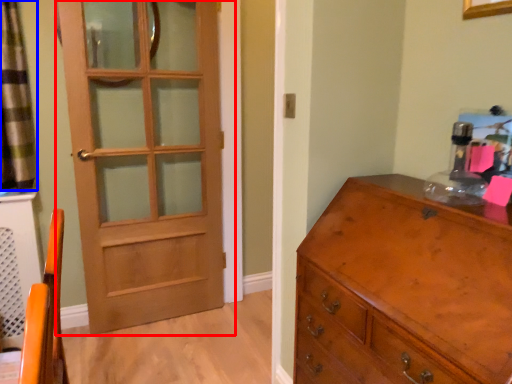
Question: Which object appears closest to the camera in this image, door (highlighted by a red box) or curtain (highlighted by a blue box)?

Choices:
 (A) door
 (B) curtain

Answer: (B)